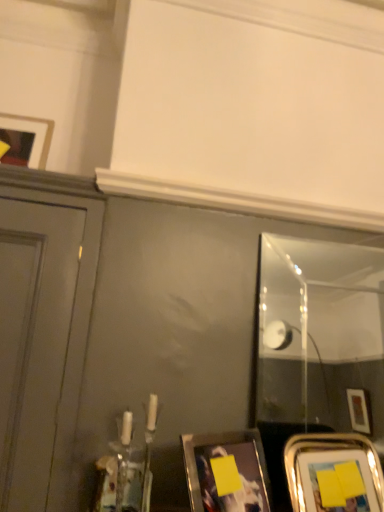
Question: In terms of height, does yellow matte picture frame at lower center, arranged as the second picture frame when viewed from the right, look taller or shorter compared to clear glass mirror at right?

Choices:
 (A) short
 (B) tall

Answer: (A)

Question: Considering the positions of yellow matte picture frame at lower center, arranged as the second picture frame when viewed from the right, and clear glass mirror at right in the image, is yellow matte picture frame at lower center, arranged as the second picture frame when viewed from the right, wider or thinner than clear glass mirror at right?

Choices:
 (A) thin
 (B) wide

Answer: (B)

Question: Which is farther from the matte black picture frame at upper left, which is the 3th picture frame from bottom to top?

Choices:
 (A) metallic silver picture frame at lower right, placed as the third picture frame when sorted from left to right
 (B) yellow matte picture frame at lower center, arranged as the second picture frame when viewed from the right
 (C) clear glass mirror at right

Answer: (C)

Question: Considering the real-world distances, which object is closest to the matte black picture frame at upper left, which is the 3th picture frame from bottom to top?

Choices:
 (A) clear glass mirror at right
 (B) metallic silver picture frame at lower right, placed as the third picture frame when sorted from left to right
 (C) yellow matte picture frame at lower center, arranged as the second picture frame when viewed from the right

Answer: (C)